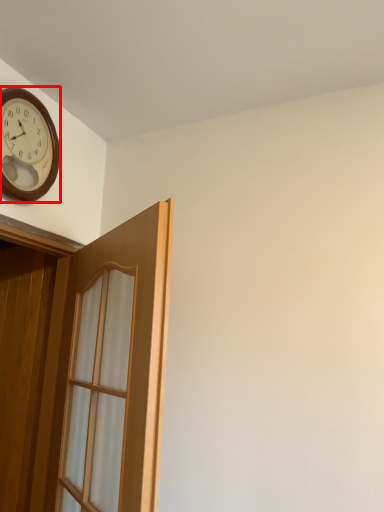
Question: Considering the relative positions of clock (annotated by the red box) and door in the image provided, where is clock (annotated by the red box) located with respect to the staircase?

Choices:
 (A) left
 (B) right

Answer: (A)